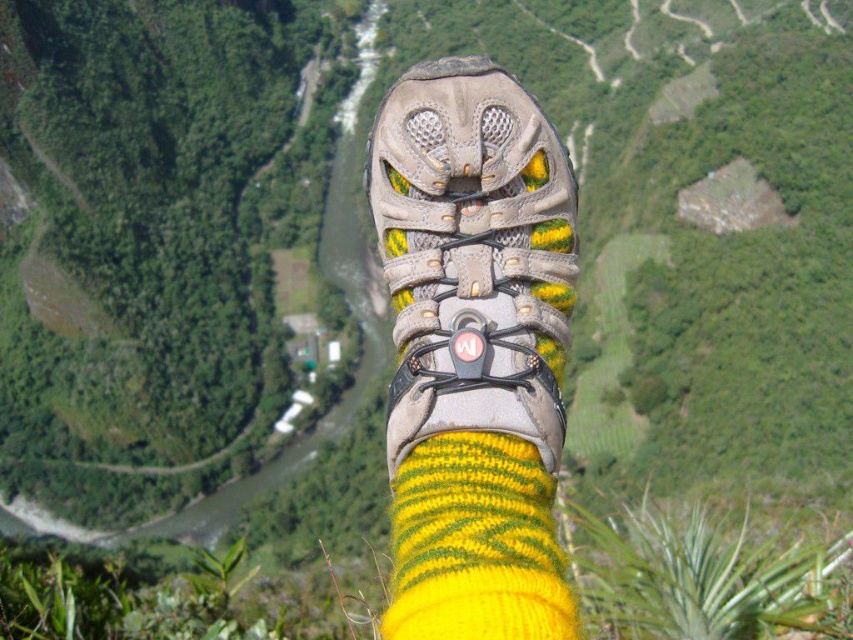
Question: Which point is closer to the camera taking this photo?

Choices:
 (A) (486, 275)
 (B) (445, 436)

Answer: (B)

Question: Is matte gray shoe at center positioned in front of yellow knitted sock at center?

Choices:
 (A) no
 (B) yes

Answer: (A)

Question: Among these objects, which one is farthest from the camera?

Choices:
 (A) yellow knitted sock at center
 (B) matte gray shoe at center

Answer: (B)

Question: Is matte gray shoe at center wider than yellow knitted sock at center?

Choices:
 (A) no
 (B) yes

Answer: (B)

Question: Which object is closer to the camera taking this photo?

Choices:
 (A) yellow knitted sock at center
 (B) matte gray shoe at center

Answer: (A)

Question: Observing the image, what is the correct spatial positioning of matte gray shoe at center in reference to yellow knitted sock at center?

Choices:
 (A) left
 (B) right

Answer: (A)